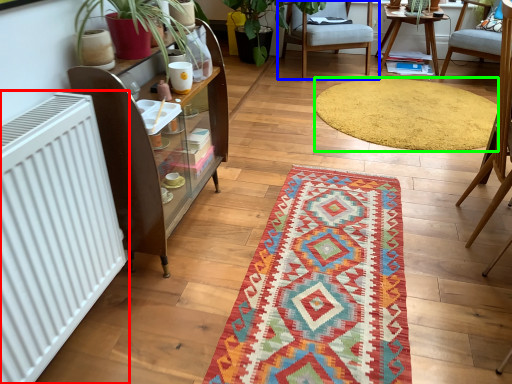
Question: Which is farther away from radiator (highlighted by a red box)? chair (highlighted by a blue box) or mat (highlighted by a green box)?

Choices:
 (A) chair
 (B) mat

Answer: (A)